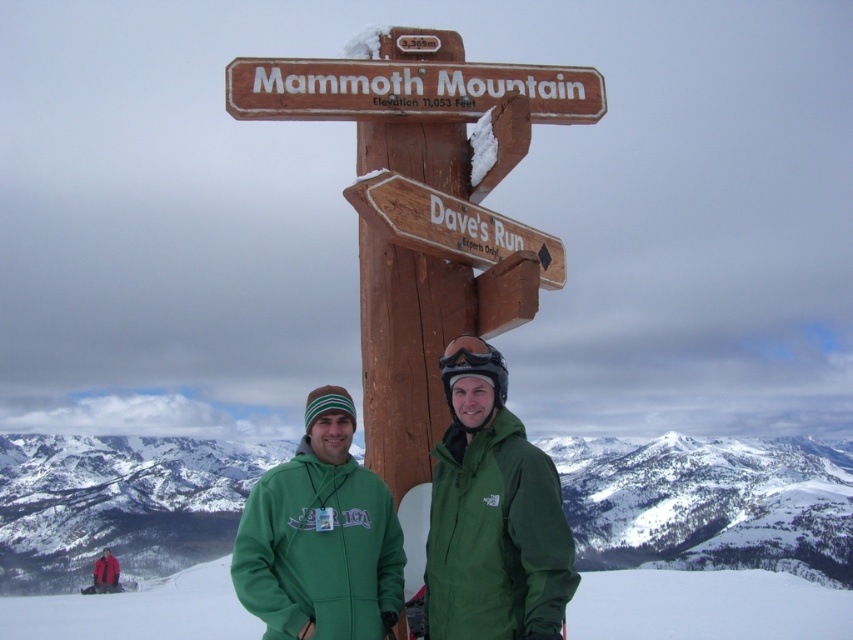
You are planning to take a photo of the snowy white mountain at center and the green matte jacket at center. Which object should you focus on first if you want both to be in sharp focus?

The snowy white mountain at center is taller than the green matte jacket at center, so you should focus on the snowy white mountain at center first to ensure both are in sharp focus.

You are planning a ski trip and need to know if the wooden mammoth mountain sign at upper center is visible from the green fabric ski slope at lower center. Based on the scene description, can you determine this?

The wooden mammoth mountain sign at upper center is behind the green fabric ski slope at lower center, so it would not be visible from there.